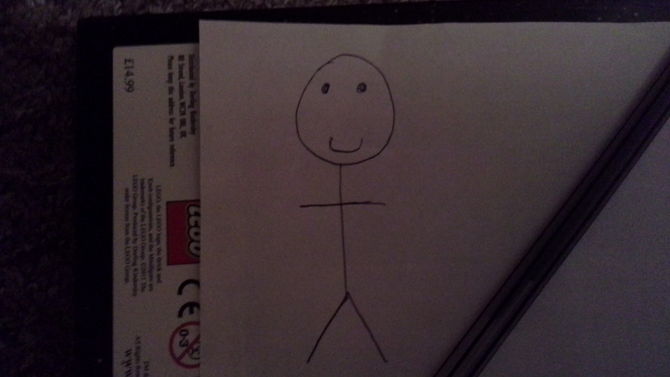
Where is `white piece of paper`? The width and height of the screenshot is (670, 377). white piece of paper is located at coordinates (438, 162).